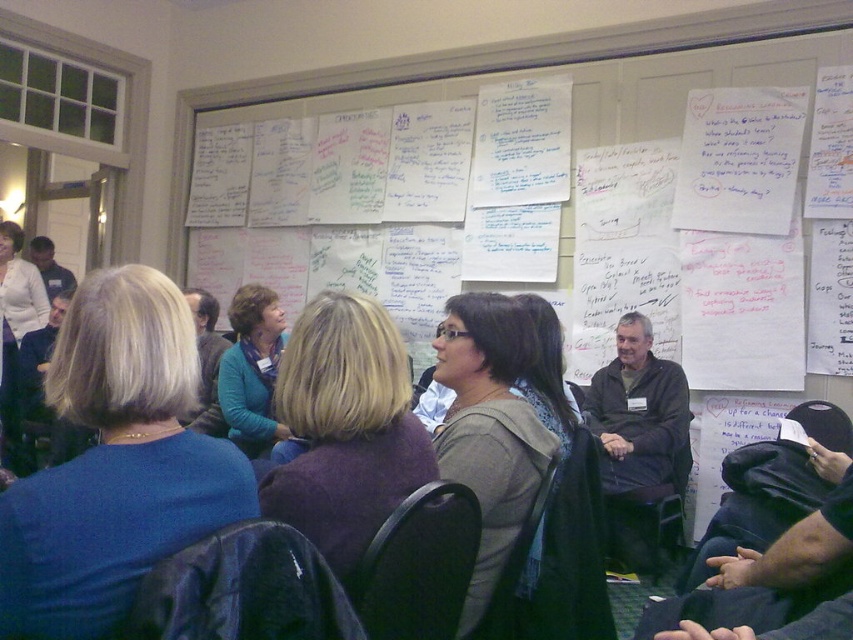
Between point (508, 385) and point (219, 394), which one is positioned in front?

Point (508, 385) is in front.

Between point (454, 404) and point (234, 368), which one is positioned in front?

Point (454, 404) is in front.

Identify the location of gray sweater at center. (489, 428).

Is blue fabric at center positioned at the back of blue sweater at center?

No.

The width and height of the screenshot is (853, 640). What do you see at coordinates (115, 464) in the screenshot?
I see `blue fabric at center` at bounding box center [115, 464].

The height and width of the screenshot is (640, 853). I want to click on blue fabric at center, so click(x=115, y=464).

Who is positioned more to the left, blue fabric at center or gray sweater at center?

blue fabric at center is more to the left.

This screenshot has height=640, width=853. I want to click on blue fabric at center, so click(x=115, y=464).